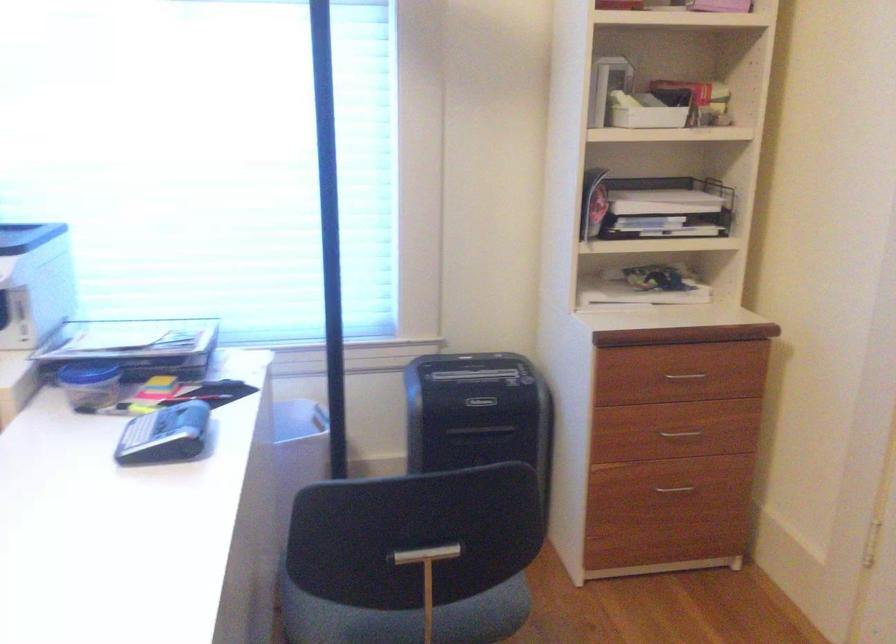
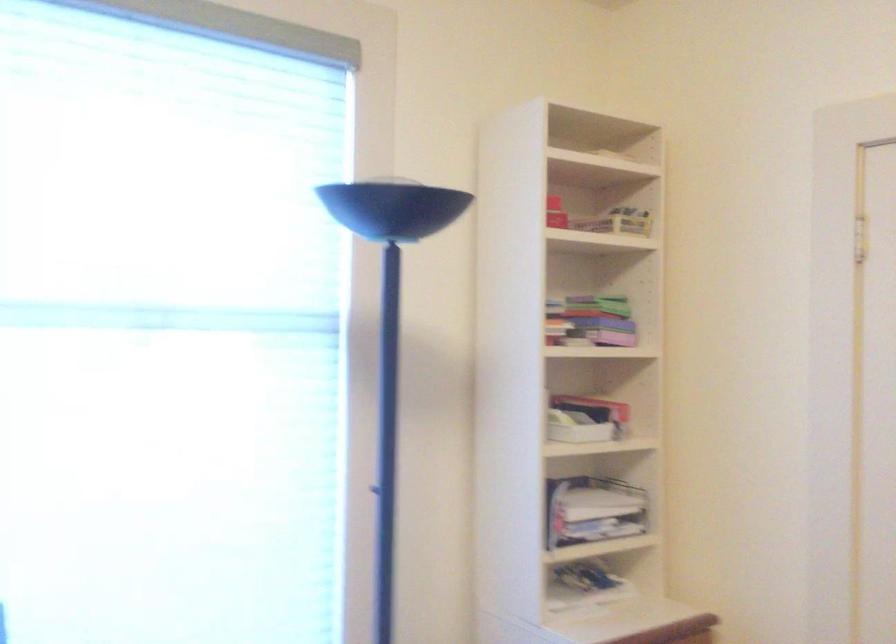
The images are taken continuously from a first-person perspective. In which direction is your viewpoint rotating?

The camera's rotation is toward right-up.